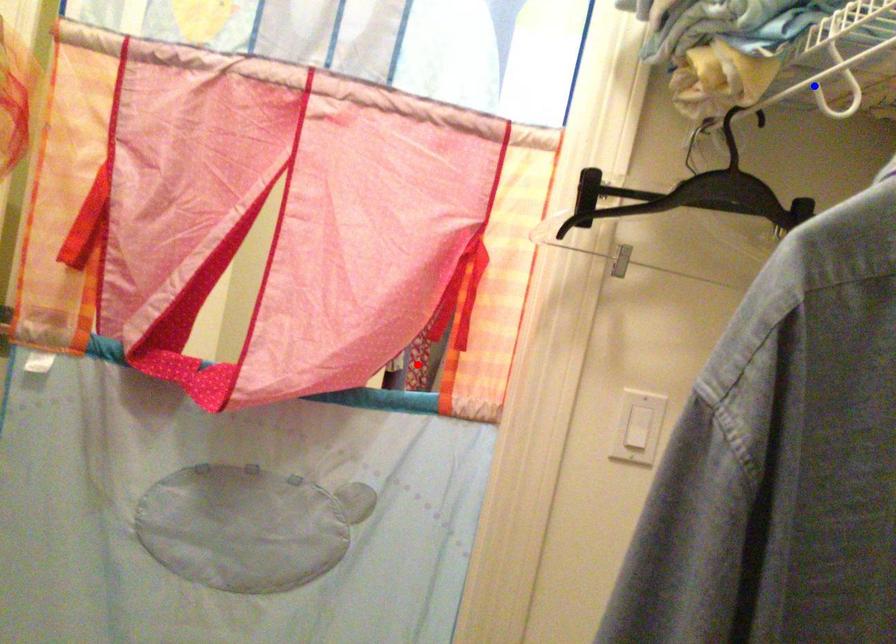
Question: In the image, two points are highlighted. Which point is nearer to the camera? Reply with the corresponding letter.

Choices:
 (A) blue point
 (B) red point

Answer: (A)